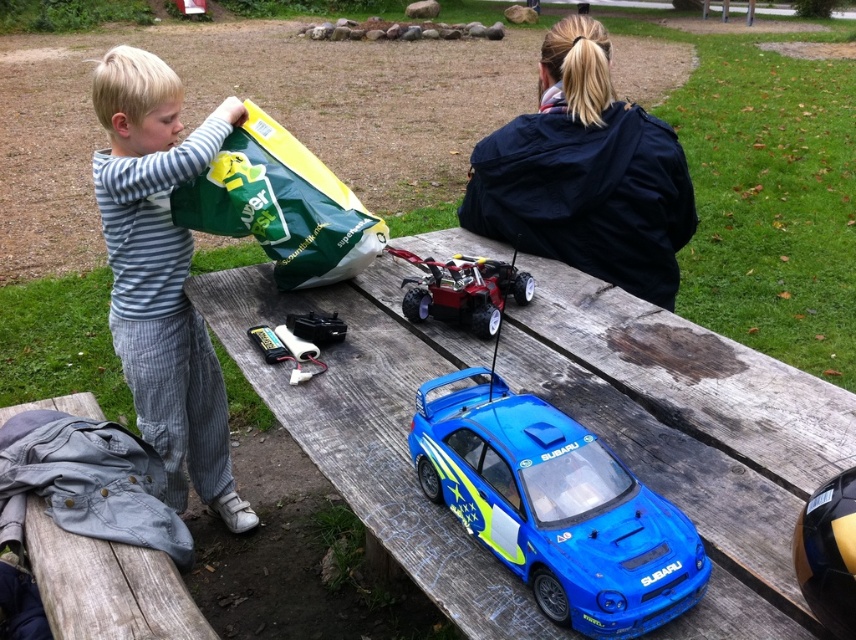
You are a photographer trying to capture a candid shot of the striped cotton shirt at left and the green matte bag at upper left. Since you want both subjects in the frame, which one should you position closer to the center of your camera viewfinder to ensure both are visible?

You should position the striped cotton shirt at left closer to the center of your camera viewfinder because it is to the left of the green matte bag at upper left, so centering it would help include both in the frame.

You are a child looking at the picnic table in the park. You see a blue glossy toy car at center and a metallic red toy car at center. Which toy car is positioned to the right when looking from the left side of the table?

The blue glossy toy car at center is positioned to the right of the metallic red toy car at center when viewed from the left side of the table.

You are trying to decide which item to place first in your backpack. The striped cotton shirt at left and the green matte bag at upper left are both in your inventory. Which item can you fit into a 15cm width compartment?

The striped cotton shirt at left has a lesser width compared to the green matte bag at upper left, so it can fit into the 15cm width compartment.